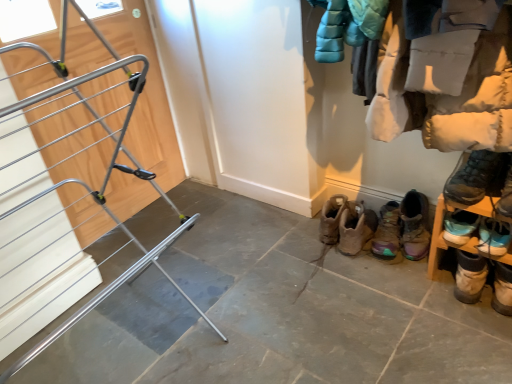
In order to click on vacant space in front of light brown suede boot at lower right, the fifth footwear when ordered from left to right in this screenshot , I will do `click(475, 333)`.